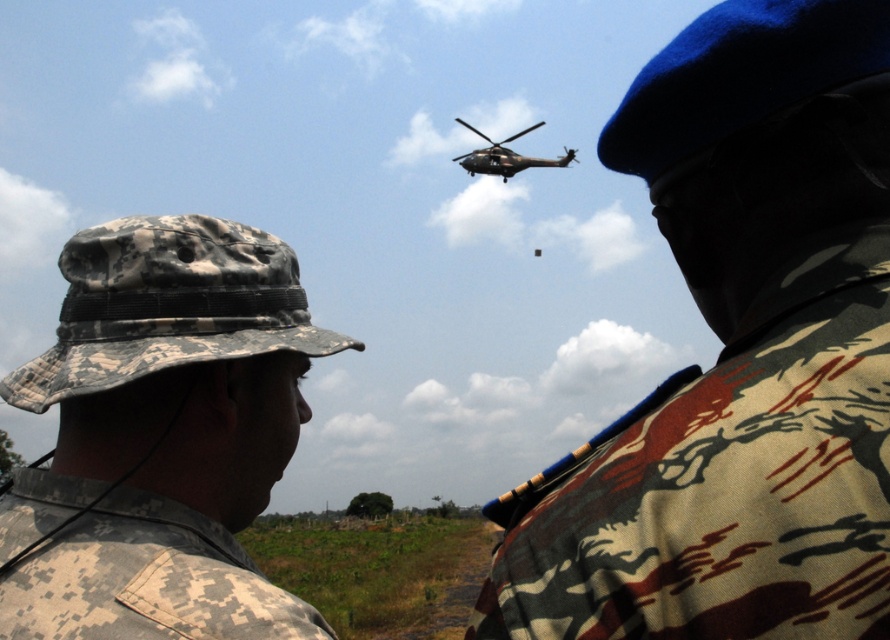
Which is more to the left, digital camouflage hat at left or digital camo fabric at lower left?

digital camouflage hat at left

Does digital camouflage hat at left have a lesser height compared to digital camo fabric at lower left?

No.

Does point (9, 504) come closer to viewer compared to point (37, 552)?

No.

This screenshot has width=890, height=640. In order to click on digital camouflage hat at left in this screenshot , I will do `click(160, 433)`.

Can you confirm if camo fabric uniform at upper right is positioned below digital camouflage hat at left?

Actually, camo fabric uniform at upper right is above digital camouflage hat at left.

Which is behind, point (682, 608) or point (257, 419)?

Positioned behind is point (257, 419).

The image size is (890, 640). Describe the element at coordinates (742, 353) in the screenshot. I see `camo fabric uniform at upper right` at that location.

The image size is (890, 640). In order to click on camo fabric uniform at upper right in this screenshot , I will do `click(742, 353)`.

The image size is (890, 640). What do you see at coordinates (160, 433) in the screenshot?
I see `digital camouflage hat at left` at bounding box center [160, 433].

Does digital camouflage hat at left come behind dark gray matte helicopter at upper center?

No, it is not.

Who is more forward, [96,560] or [520,164]?

Point [96,560]

You are a GUI agent. You are given a task and a screenshot of the screen. Output one action in this format:
    pyautogui.click(x=<x>, y=<y>)
    Task: Click on the digital camouflage hat at left
    The height and width of the screenshot is (640, 890).
    Given the screenshot: What is the action you would take?
    pyautogui.click(x=160, y=433)